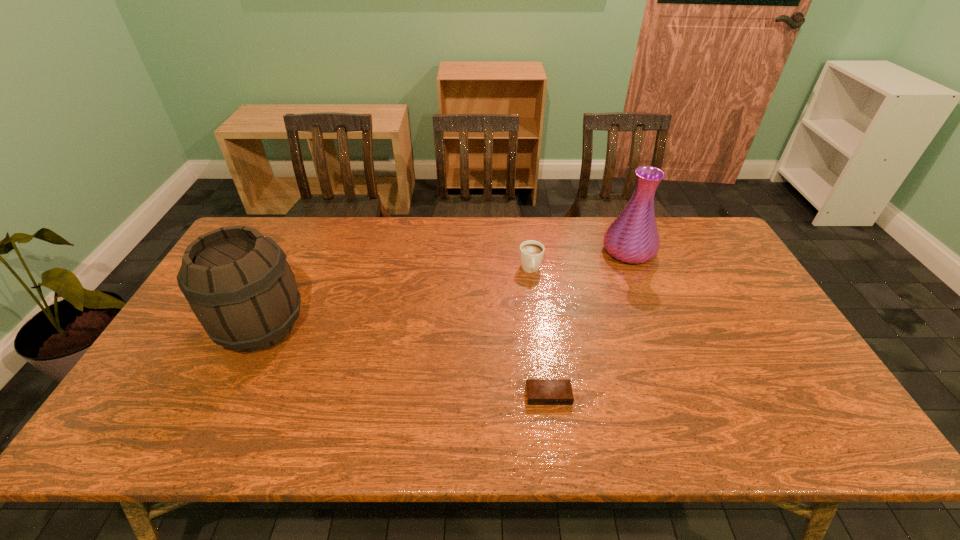
Identify the location of the rightmost object. (633, 237).

Where is `the leftmost object`? The height and width of the screenshot is (540, 960). the leftmost object is located at coordinates (237, 281).

This screenshot has height=540, width=960. I want to click on wine bucket, so click(x=237, y=281).

Where is `cappuccino`? Image resolution: width=960 pixels, height=540 pixels. cappuccino is located at coordinates (531, 252).

The image size is (960, 540). I want to click on alarm clock, so click(539, 391).

This screenshot has width=960, height=540. I want to click on the shortest object, so pyautogui.click(x=539, y=391).

This screenshot has width=960, height=540. In order to click on free spot located on the left of the vase in this screenshot , I will do `click(520, 251)`.

Locate an element on the screen. The image size is (960, 540). free space located on the back of the wine bucket is located at coordinates coord(282,285).

Where is `free region located 0.330m with the handle on the side of the second shortest object`? The height and width of the screenshot is (540, 960). free region located 0.330m with the handle on the side of the second shortest object is located at coordinates (543, 368).

This screenshot has height=540, width=960. Identify the location of free space located on the front face of the shortest object. (554, 433).